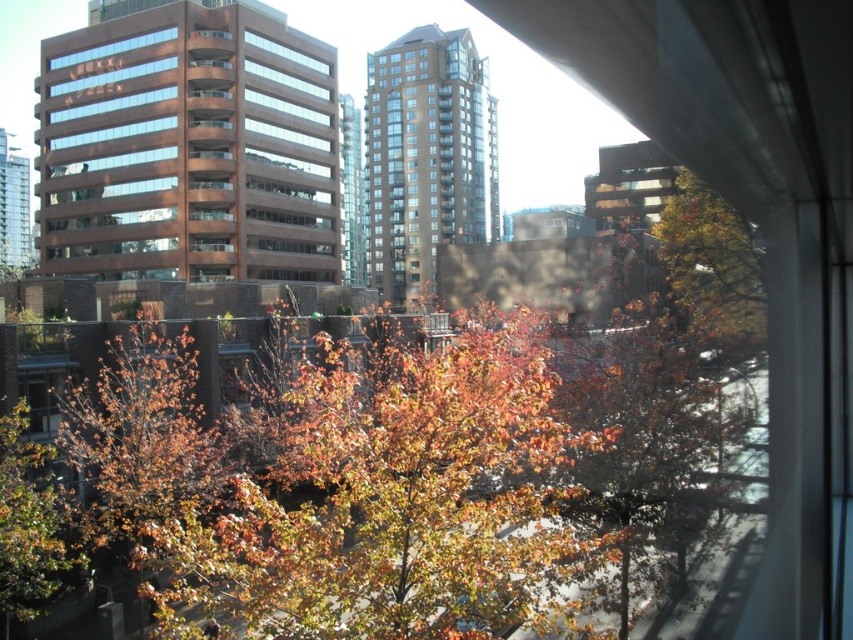
Does autumn leaves at center appear on the left side of green leafy tree at lower left?

In fact, autumn leaves at center is to the right of green leafy tree at lower left.

Is point (741, 301) behind point (45, 461)?

No, it is not.

Identify the location of autumn leaves at center. Image resolution: width=853 pixels, height=640 pixels. (712, 262).